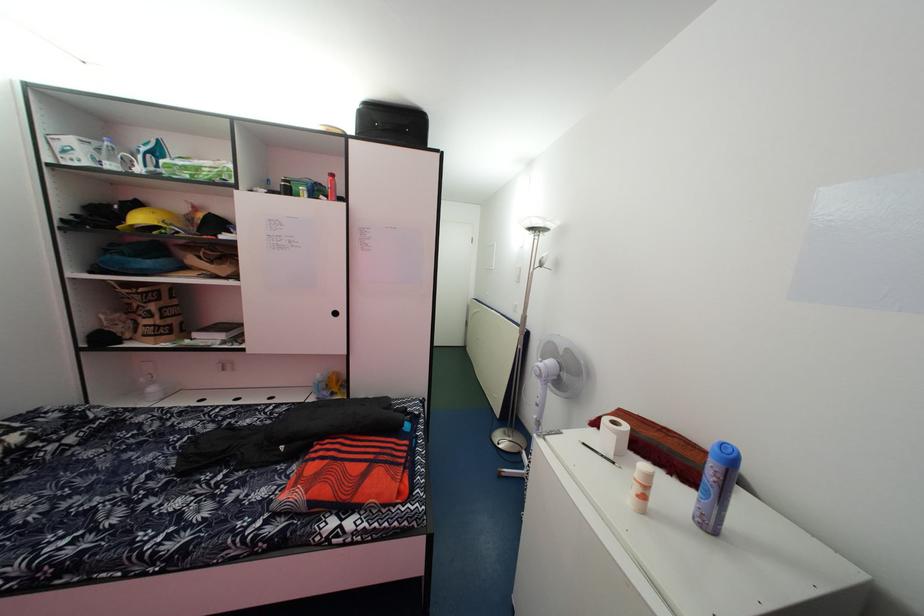
Where is `black pencil`? The image size is (924, 616). black pencil is located at coordinates (600, 454).